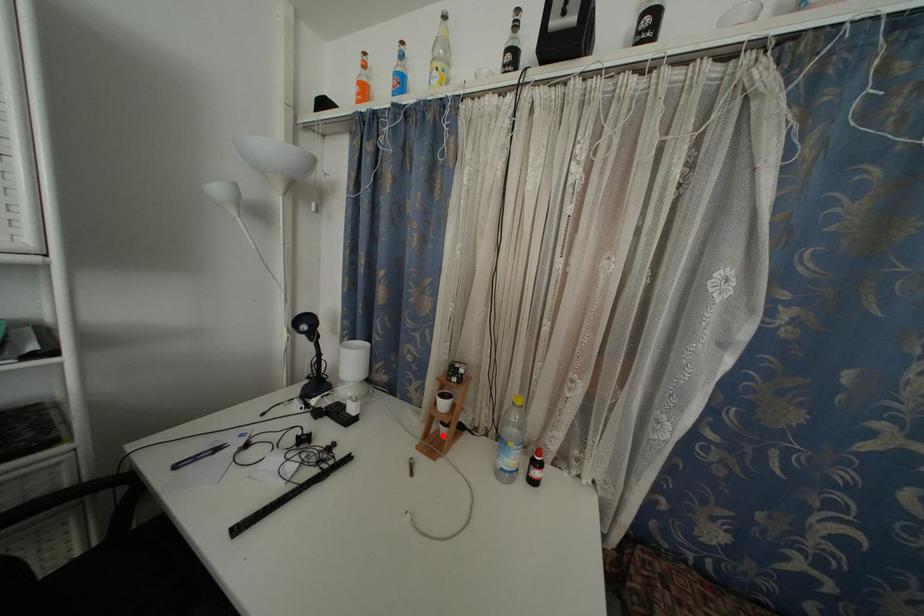
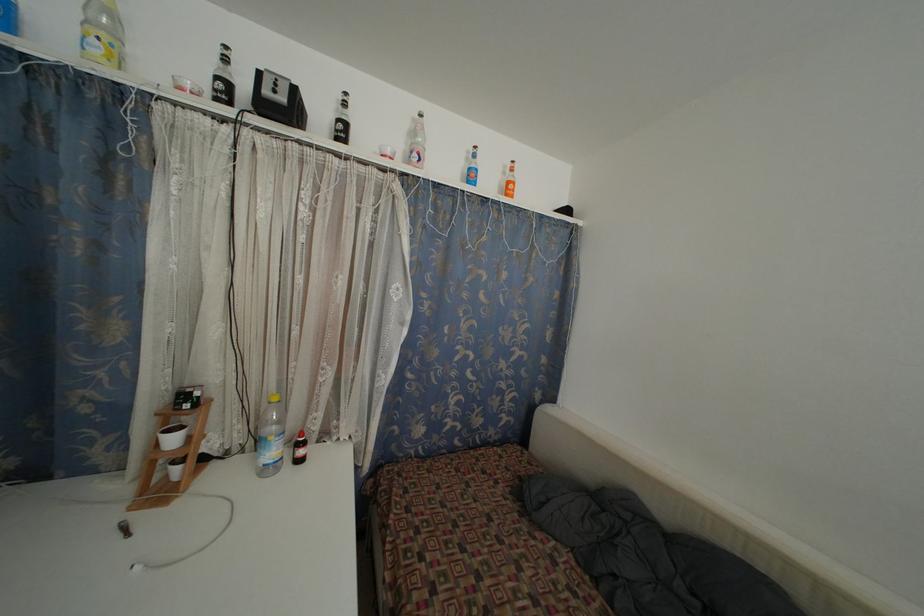
Question: A red point is marked in image1. In image2, is the corresponding 3D point closer to the camera or farther? Reply with the corresponding letter.

Choices:
 (A) The corresponding 3D point is closer.
 (B) The corresponding 3D point is farther.

Answer: (A)